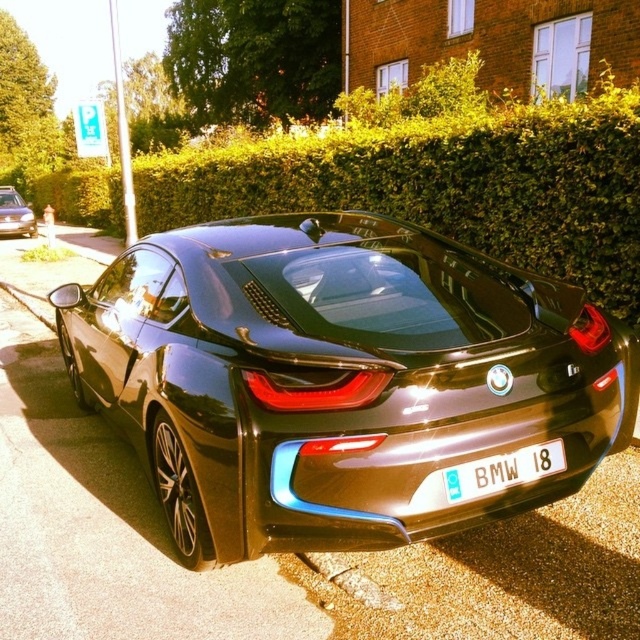
Question: Which of the following is the closest to the observer?

Choices:
 (A) (33, 236)
 (B) (4, 292)
 (C) (419, 204)
 (D) (76, 288)

Answer: (D)

Question: Does green leafy hedge at upper center come behind matte black car at left?

Choices:
 (A) yes
 (B) no

Answer: (B)

Question: From the image, what is the correct spatial relationship of green leafy hedge at upper center in relation to white plastic license plate at rear?

Choices:
 (A) right
 (B) left

Answer: (B)

Question: Estimate the real-world distances between objects in this image. Which object is closer to the concrete at lower left?

Choices:
 (A) matte black car at left
 (B) white plastic license plate at rear
 (C) green leafy hedge at upper center
 (D) glossy black sports car at center

Answer: (C)

Question: Which point is farther to the camera?

Choices:
 (A) (182, 259)
 (B) (13, 204)
 (C) (24, 292)
 (D) (557, 464)

Answer: (B)

Question: Is matte black car at left further to camera compared to concrete at lower left?

Choices:
 (A) yes
 (B) no

Answer: (A)